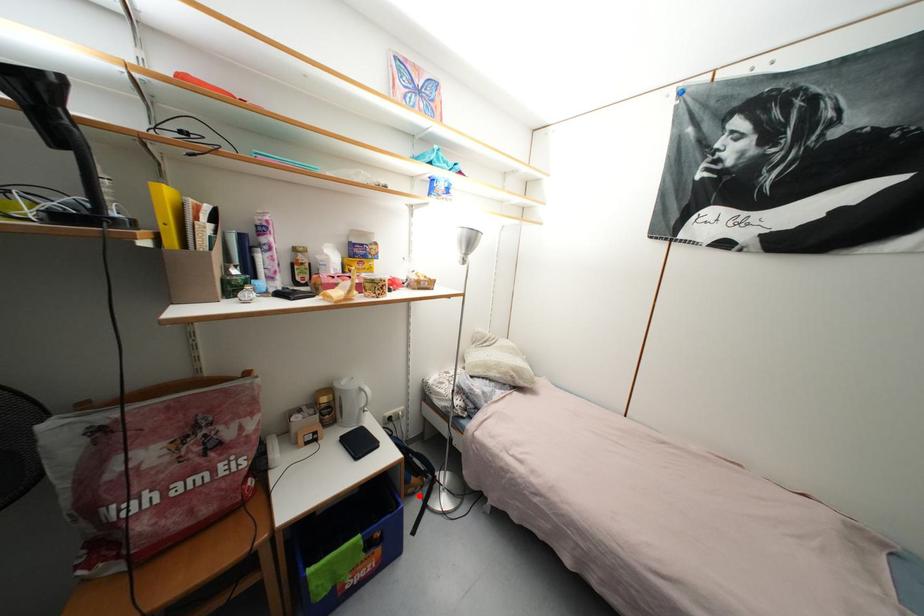
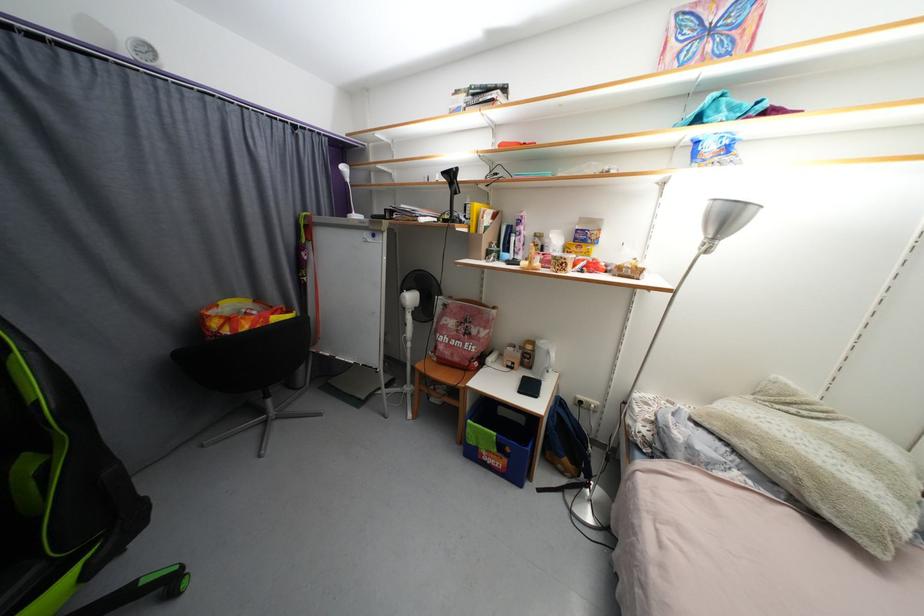
The point at the highlighted location is marked in the first image. Where is the corresponding point in the second image?

(567, 475)